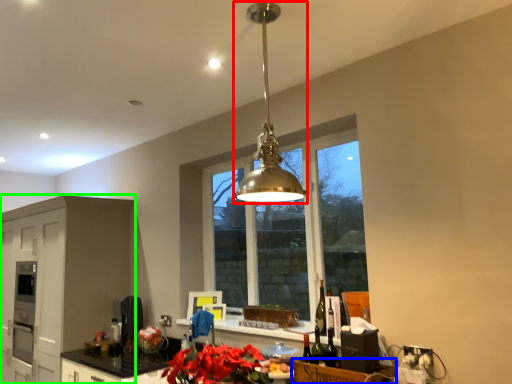
Question: Which object is positioned farthest from light fixture (highlighted by a red box)? Select from cardboard box (highlighted by a blue box) and cabinetry (highlighted by a green box).

Choices:
 (A) cardboard box
 (B) cabinetry

Answer: (B)